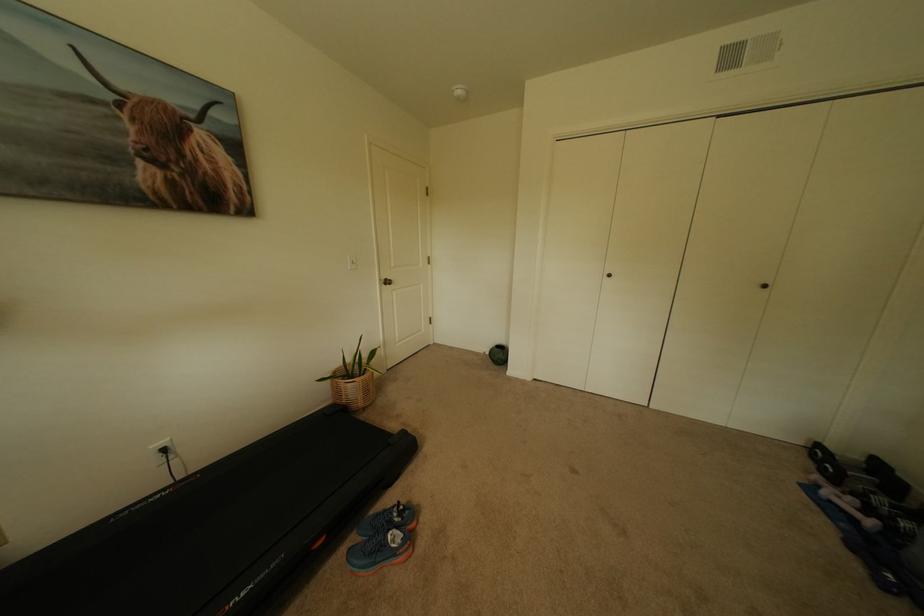
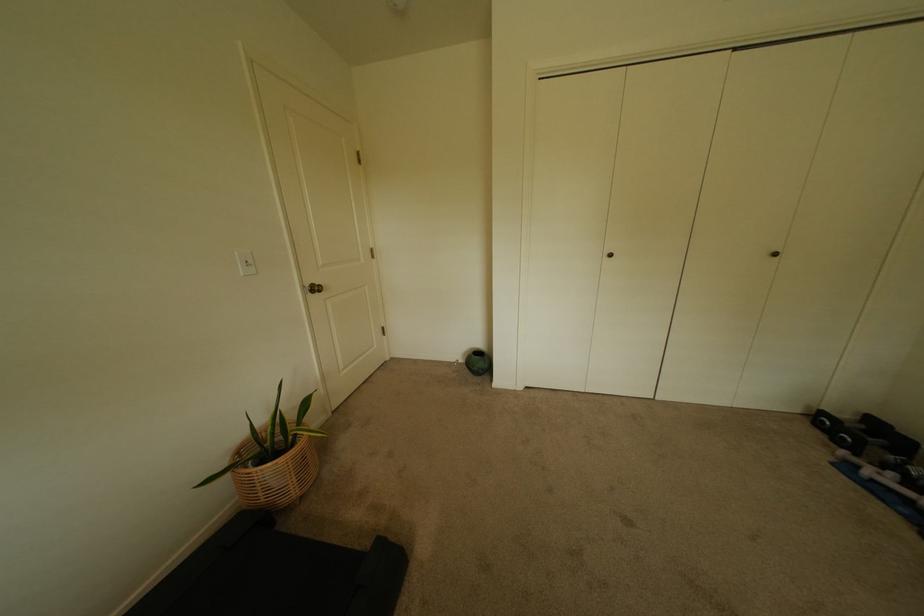
In the second image, find the point that corresponds to point 828,447 in the first image.

(831, 415)